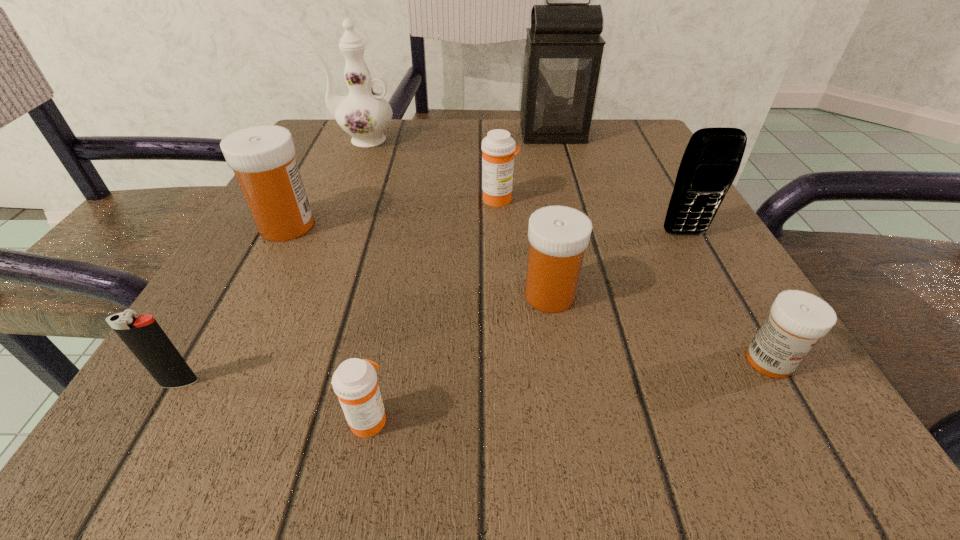
The width and height of the screenshot is (960, 540). I want to click on the tallest object, so click(x=561, y=67).

Identify the location of gray lantern. (561, 67).

Locate an element on the screen. This screenshot has width=960, height=540. chinaware is located at coordinates pos(364,114).

You are a GUI agent. You are given a task and a screenshot of the screen. Output one action in this format:
    pyautogui.click(x=<x>, y=<y>)
    Task: Click on the cellular telephone
    The height and width of the screenshot is (540, 960).
    Given the screenshot: What is the action you would take?
    pyautogui.click(x=710, y=163)

The image size is (960, 540). I want to click on the farthest white medicine, so click(262, 157).

The image size is (960, 540). I want to click on the biggest white medicine, so click(x=262, y=157).

Where is `the seventh nearest object`? The height and width of the screenshot is (540, 960). the seventh nearest object is located at coordinates (498, 148).

The height and width of the screenshot is (540, 960). What are the coordinates of `the farthest medicine` in the screenshot? It's located at (498, 148).

The image size is (960, 540). In order to click on the third farthest medicine in this screenshot , I will do `click(558, 235)`.

Locate an element on the screen. the second biggest white medicine is located at coordinates (558, 235).